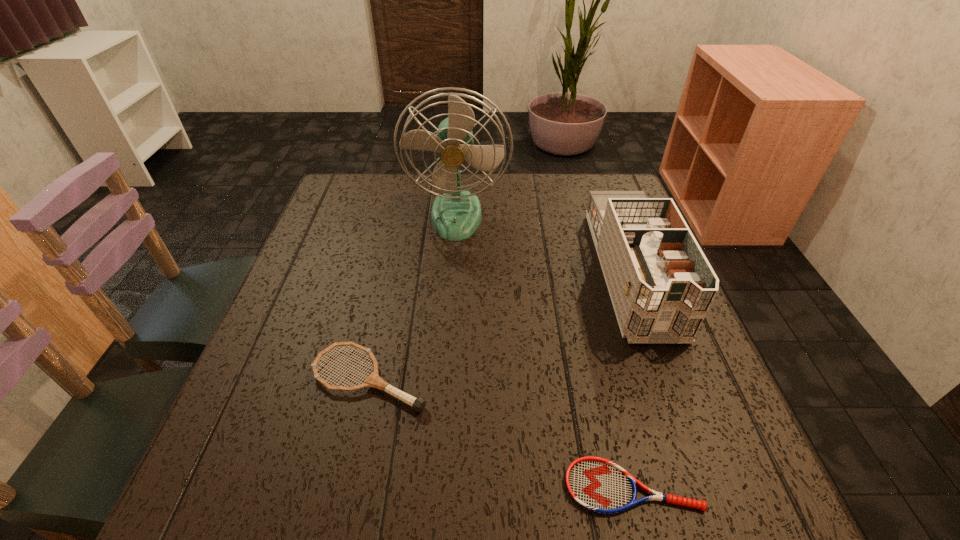
Identify the location of vacant point at the left edge. (256, 380).

In the image, there is a desktop. Identify the location of vacant space at the right edge. (639, 368).

At what (x,y) coordinates should I click in order to perform the action: click on vacant space at the far left corner of the desktop. Please return your answer as a coordinate pair (x, y). The height and width of the screenshot is (540, 960). Looking at the image, I should click on (358, 188).

Locate an element on the screen. vacant region at the far right corner of the desktop is located at coordinates (621, 185).

Locate an element on the screen. The image size is (960, 540). vacant area between the tallest object and the farther tennis racket is located at coordinates (413, 297).

Where is `free space between the fan and the left tennis racket`? Image resolution: width=960 pixels, height=540 pixels. free space between the fan and the left tennis racket is located at coordinates (413, 297).

The image size is (960, 540). Identify the location of empty location between the second tallest object and the tallest object. (543, 244).

Identify the location of vacant space that is in between the second tallest object and the fan. coord(543,244).

Locate an element on the screen. The image size is (960, 540). vacant space that's between the third shortest object and the taller tennis racket is located at coordinates (500, 325).

This screenshot has height=540, width=960. Identify the location of vacant space in between the left tennis racket and the second tallest object. (500, 325).